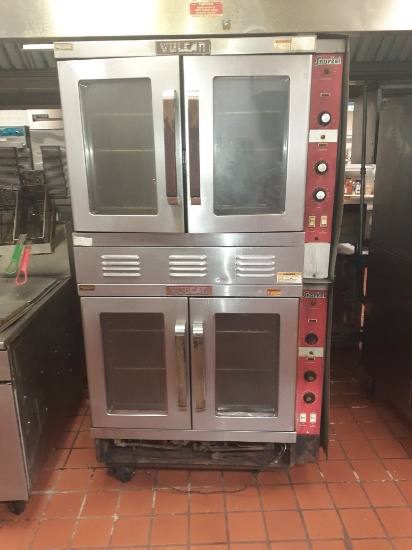
Where is `fryer basket`? Image resolution: width=412 pixels, height=550 pixels. fryer basket is located at coordinates (33, 220).